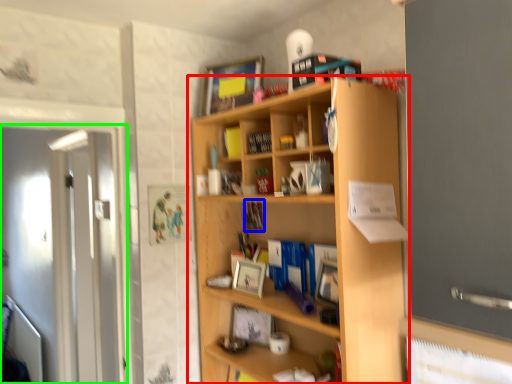
Question: Which object is the farthest from shelf (highlighted by a red box)? Choose among these: book (highlighted by a blue box) or screen door (highlighted by a green box).

Choices:
 (A) book
 (B) screen door

Answer: (B)